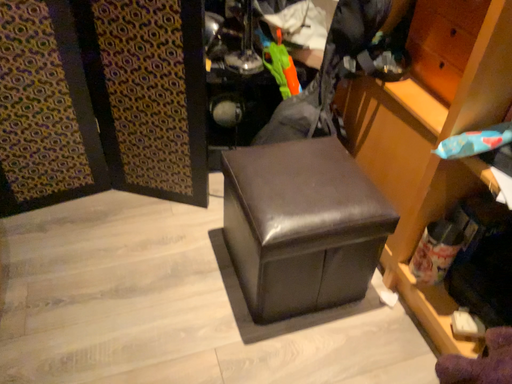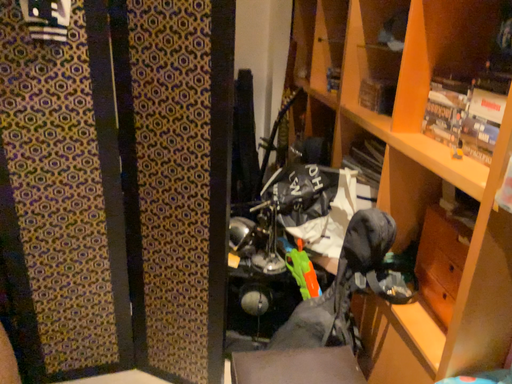
Question: Which way did the camera rotate in the video?

Choices:
 (A) rotated left
 (B) rotated right

Answer: (A)